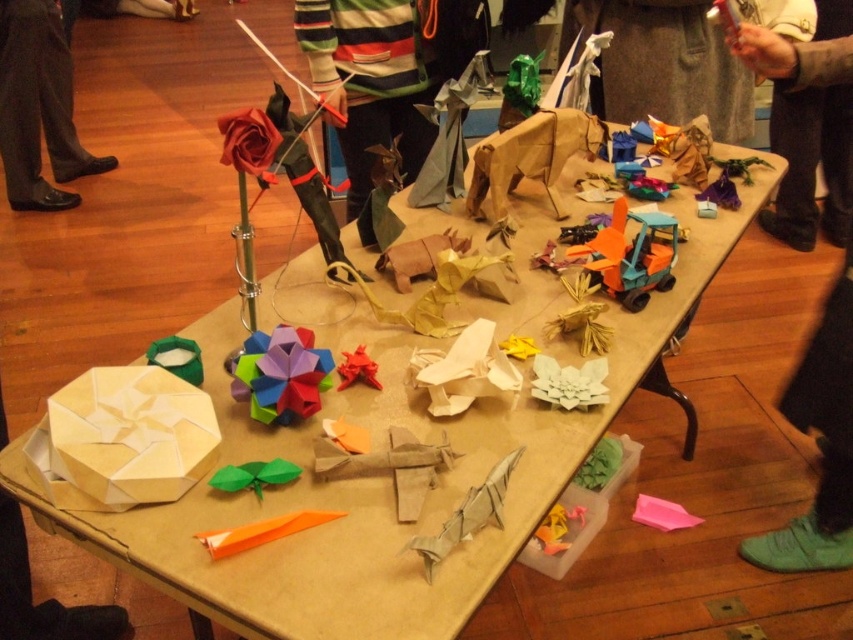
Can you confirm if black leather shoes at lower left is bigger than translucent orange plastic toy truck at center?

Correct, black leather shoes at lower left is larger in size than translucent orange plastic toy truck at center.

Image resolution: width=853 pixels, height=640 pixels. What do you see at coordinates (38, 108) in the screenshot? I see `black leather shoes at lower left` at bounding box center [38, 108].

Is point (44, 182) farther from viewer compared to point (614, 284)?

Yes, point (44, 182) is farther from viewer.

Where is `black leather shoes at lower left`? This screenshot has height=640, width=853. black leather shoes at lower left is located at coordinates (38, 108).

Is translucent orange plastic toy truck at center smaller than rubberized plastic origami star at center?

No.

I want to click on translucent orange plastic toy truck at center, so pos(631,253).

Between point (592, 237) and point (361, 353), which one is positioned in front?

Positioned in front is point (361, 353).

At what (x,y) coordinates should I click in order to perform the action: click on translucent orange plastic toy truck at center. Please return your answer as a coordinate pair (x, y). This screenshot has height=640, width=853. Looking at the image, I should click on (631, 253).

Does point (848, 77) come closer to viewer compared to point (184, 372)?

No, (848, 77) is further to viewer.

Does brown leather jacket at upper right have a lesser width compared to green matte origami at center?

No, brown leather jacket at upper right is not thinner than green matte origami at center.

What are the coordinates of `brown leather jacket at upper right` in the screenshot? It's located at (810, 163).